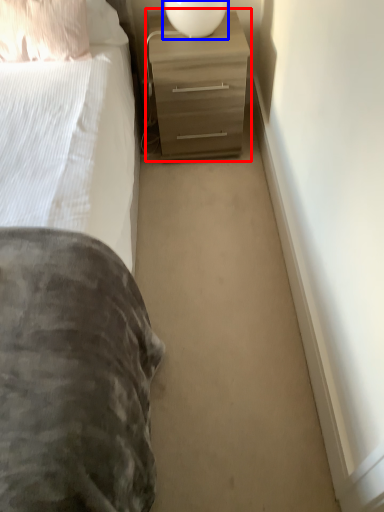
Question: Which of the following is the farthest to the observer, chest of drawers (highlighted by a red box) or table lamp (highlighted by a blue box)?

Choices:
 (A) chest of drawers
 (B) table lamp

Answer: (A)